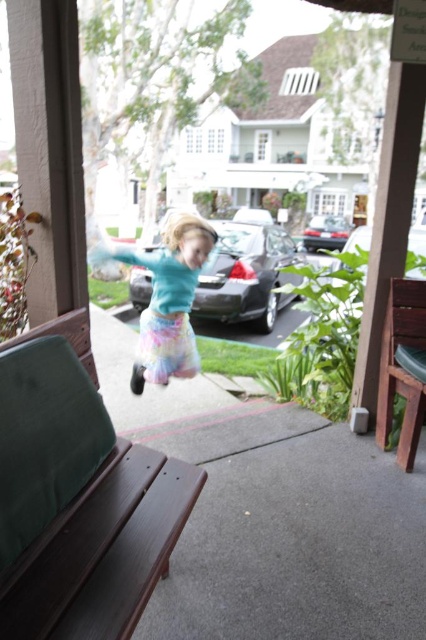
You are a photographer trying to capture the girl in midair. You notice the pastel cotton ballet skirt at center and the shiny black car at center. Which object is closer to the camera based on their positions?

The pastel cotton ballet skirt at center is in front of the shiny black car at center, so it is closer to the camera.